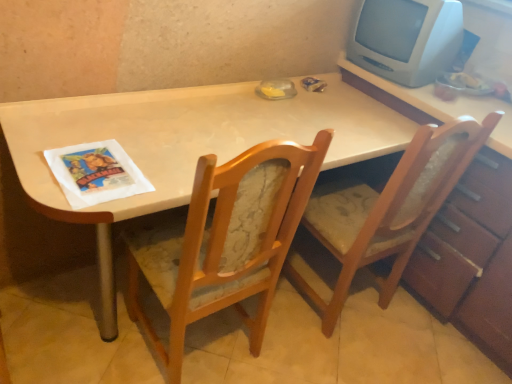
Locate an element on the screen. wooden dresser at right is located at coordinates (462, 221).

Identify the location of wooden textured chair at right, acting as the 1th chair starting from the right. This screenshot has width=512, height=384. (388, 210).

Measure the distance between point (126, 159) and camera.

Point (126, 159) and camera are 3.98 feet apart.

This screenshot has height=384, width=512. In order to click on wooden chair with fabric cushion at center, acting as the 1th chair starting from the left in this screenshot , I will do `click(225, 241)`.

From a real-world perspective, is white plastic monitor at upper right located beneath white paper magazine at left?

Incorrect, from a real-world perspective, white plastic monitor at upper right is higher than white paper magazine at left.

In terms of width, does white plastic monitor at upper right look wider or thinner when compared to white paper magazine at left?

Considering their sizes, white plastic monitor at upper right looks broader than white paper magazine at left.

Does white plastic monitor at upper right have a greater height compared to white paper magazine at left?

Indeed, white plastic monitor at upper right has a greater height compared to white paper magazine at left.

Would you consider wooden chair with fabric cushion at center, acting as the 1th chair starting from the left, to be distant from white paper magazine at left?

That's not correct — wooden chair with fabric cushion at center, acting as the 1th chair starting from the left, is a little close to white paper magazine at left.

Does wooden chair with fabric cushion at center, the second chair positioned from the right, have a greater height compared to white paper magazine at left?

Yes, wooden chair with fabric cushion at center, the second chair positioned from the right, is taller than white paper magazine at left.

From a real-world perspective, who is located higher, wooden chair with fabric cushion at center, acting as the 1th chair starting from the left, or white paper magazine at left?

Answer: white paper magazine at left is physically above.

Is wooden chair with fabric cushion at center, the second chair positioned from the right, located outside white paper magazine at left?

Yes.

Is the depth of wooden chair with fabric cushion at center, acting as the 1th chair starting from the left, greater than that of wooden dresser at right?

No, it is in front of wooden dresser at right.

Between wooden chair with fabric cushion at center, acting as the 1th chair starting from the left, and wooden dresser at right, which one appears on the right side from the viewer's perspective?

From the viewer's perspective, wooden dresser at right appears more on the right side.

Is wooden chair with fabric cushion at center, acting as the 1th chair starting from the left, with wooden dresser at right?

wooden chair with fabric cushion at center, acting as the 1th chair starting from the left, and wooden dresser at right are clearly separated.

Which object is closer to the camera, wooden textured chair at right, which is the second chair from left to right, or wooden table at center?

wooden table at center.

Is wooden textured chair at right, acting as the 1th chair starting from the right, inside the boundaries of wooden table at center, or outside?

The correct answer is: inside.

Find the location of a particular element. The height and width of the screenshot is (384, 512). table located on the left of wooden textured chair at right, acting as the 1th chair starting from the right is located at coordinates (184, 144).

Considering the sizes of objects wooden textured chair at right, acting as the 1th chair starting from the right, and wooden table at center in the image provided, who is taller, wooden textured chair at right, acting as the 1th chair starting from the right, or wooden table at center?

With more height is wooden textured chair at right, acting as the 1th chair starting from the right.

Considering the relative sizes of wooden dresser at right and white paper magazine at left in the image provided, is wooden dresser at right thinner than white paper magazine at left?

No.

Where is `magazine above the wooden dresser at right (from the image's perspective)`? This screenshot has width=512, height=384. magazine above the wooden dresser at right (from the image's perspective) is located at coordinates (96, 173).

Is wooden dresser at right not inside white paper magazine at left?

Yes, wooden dresser at right is located beyond the bounds of white paper magazine at left.

Is point (217, 258) more distant than point (312, 122)?

No.

From a real-world perspective, is wooden chair with fabric cushion at center, acting as the 1th chair starting from the left, over wooden table at center?

Correct, in the physical world, wooden chair with fabric cushion at center, acting as the 1th chair starting from the left, is higher than wooden table at center.

Is wooden chair with fabric cushion at center, acting as the 1th chair starting from the left, oriented towards wooden table at center?

Yes, wooden chair with fabric cushion at center, acting as the 1th chair starting from the left, is facing wooden table at center.

Looking at this image, considering the relative sizes of wooden chair with fabric cushion at center, the second chair positioned from the right, and wooden table at center in the image provided, is wooden chair with fabric cushion at center, the second chair positioned from the right, taller than wooden table at center?

Yes, wooden chair with fabric cushion at center, the second chair positioned from the right, is taller than wooden table at center.

Is wooden table at center looking in the opposite direction of wooden chair with fabric cushion at center, the second chair positioned from the right?

Yes.

Is there a large distance between wooden table at center and wooden chair with fabric cushion at center, the second chair positioned from the right?

No, there isn't a large distance between wooden table at center and wooden chair with fabric cushion at center, the second chair positioned from the right.

From the picture: From the image's perspective, does wooden table at center appear higher than wooden chair with fabric cushion at center, acting as the 1th chair starting from the left?

Correct, wooden table at center appears higher than wooden chair with fabric cushion at center, acting as the 1th chair starting from the left, in the image.

From a real-world perspective, between wooden table at center and wooden chair with fabric cushion at center, the second chair positioned from the right, who is vertically lower?

wooden table at center, from a real-world perspective.

Identify the location of magazine directly beneath the white plastic monitor at upper right (from a real-world perspective). Image resolution: width=512 pixels, height=384 pixels. (96, 173).

Where is `magazine behind the wooden chair with fabric cushion at center, the second chair positioned from the right`? This screenshot has height=384, width=512. magazine behind the wooden chair with fabric cushion at center, the second chair positioned from the right is located at coordinates (96, 173).

When comparing their distances from white plastic monitor at upper right, does wooden textured chair at right, acting as the 1th chair starting from the right, or wooden dresser at right seem further?

wooden textured chair at right, acting as the 1th chair starting from the right, is further to white plastic monitor at upper right.

Looking at the image, which one is located closer to wooden table at center, wooden chair with fabric cushion at center, acting as the 1th chair starting from the left, or white plastic monitor at upper right?

wooden chair with fabric cushion at center, acting as the 1th chair starting from the left.

Looking at the image, which one is located closer to white plastic monitor at upper right, wooden dresser at right or wooden table at center?

wooden dresser at right is closer to white plastic monitor at upper right.

Considering their positions, is wooden table at center positioned further to wooden chair with fabric cushion at center, acting as the 1th chair starting from the left, than wooden dresser at right?

Among the two, wooden dresser at right is located further to wooden chair with fabric cushion at center, acting as the 1th chair starting from the left.

When comparing their distances from wooden textured chair at right, acting as the 1th chair starting from the right, does white plastic monitor at upper right or wooden table at center seem further?

The object further to wooden textured chair at right, acting as the 1th chair starting from the right, is white plastic monitor at upper right.

Estimate the real-world distances between objects in this image. Which object is closer to wooden table at center, wooden textured chair at right, acting as the 1th chair starting from the right, or wooden dresser at right?

wooden textured chair at right, acting as the 1th chair starting from the right, lies closer to wooden table at center than the other object.

Considering their positions, is wooden table at center positioned closer to wooden dresser at right than wooden chair with fabric cushion at center, acting as the 1th chair starting from the left?

wooden table at center is positioned closer to the anchor wooden dresser at right.

Which object lies nearer to the anchor point white plastic monitor at upper right, wooden chair with fabric cushion at center, acting as the 1th chair starting from the left, or wooden dresser at right?

wooden dresser at right is positioned closer to the anchor white plastic monitor at upper right.

The width and height of the screenshot is (512, 384). Identify the location of table situated between white paper magazine at left and white plastic monitor at upper right from left to right. (184, 144).

Locate an element on the screen. Image resolution: width=512 pixels, height=384 pixels. computer monitor between wooden table at center and wooden dresser at right is located at coordinates (406, 39).

Locate an element on the screen. This screenshot has height=384, width=512. chair between white paper magazine at left and wooden textured chair at right, which is the second chair from left to right, from left to right is located at coordinates (225, 241).

At what (x,y) coordinates should I click in order to perform the action: click on computer monitor between wooden chair with fabric cushion at center, the second chair positioned from the right, and wooden dresser at right from left to right. Please return your answer as a coordinate pair (x, y). This screenshot has height=384, width=512. Looking at the image, I should click on (406, 39).